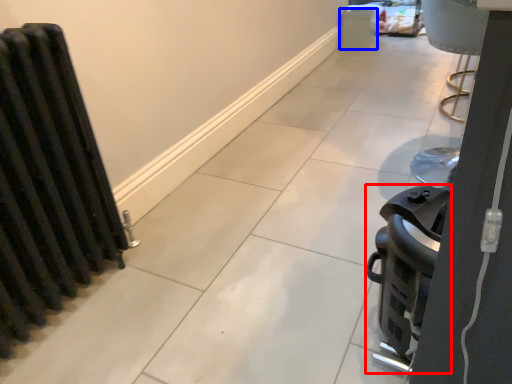
Question: Among these objects, which one is farthest to the camera, appliance (highlighted by a red box) or appliance (highlighted by a blue box)?

Choices:
 (A) appliance
 (B) appliance

Answer: (B)